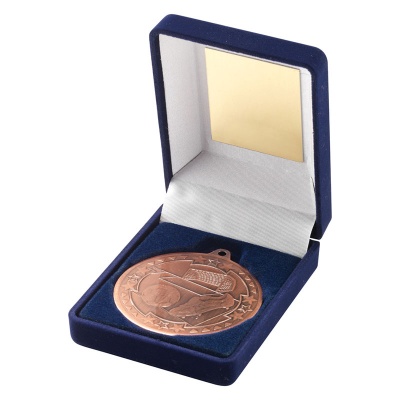
Image resolution: width=400 pixels, height=400 pixels. Find the location of `award`. award is located at coordinates (175, 302).